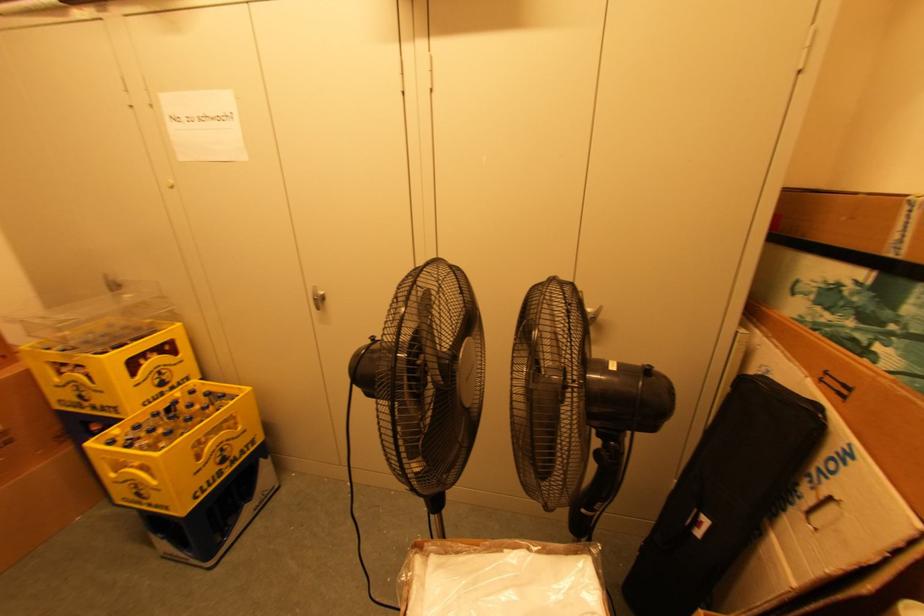
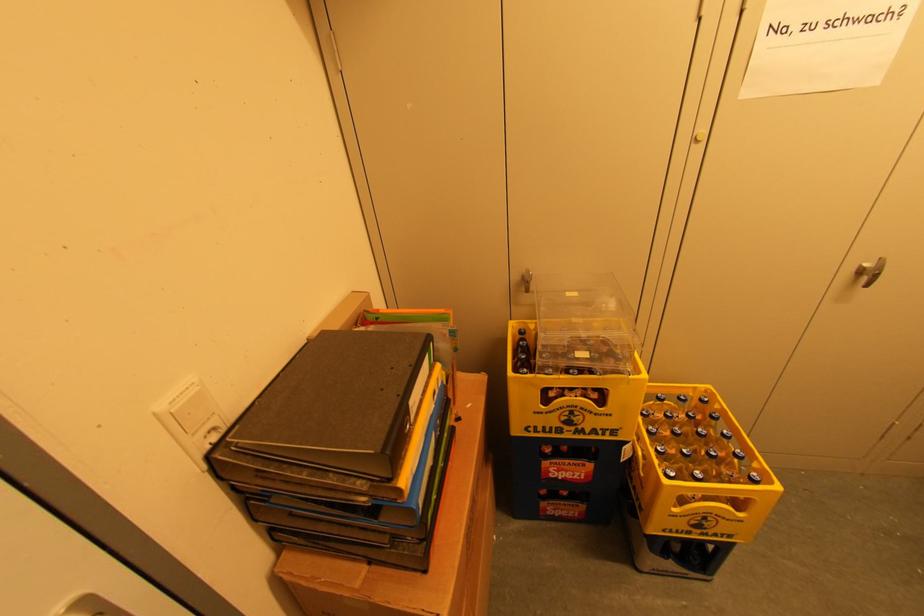
Find the pixel in the second image that matches point 223,395 in the first image.

(686, 398)